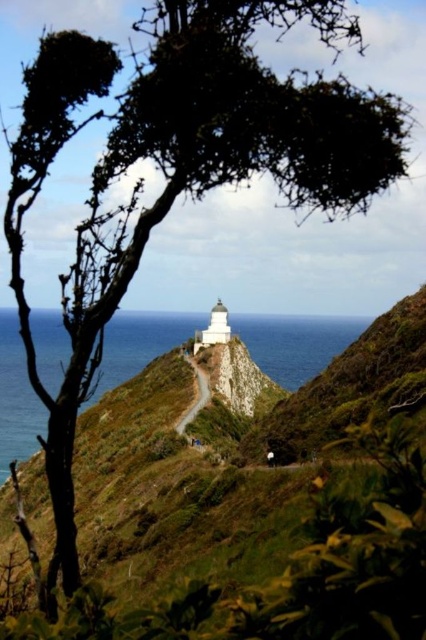
Question: Which object appears closest to the camera in this image?

Choices:
 (A) smooth concrete path at center
 (B) blue water at center

Answer: (A)

Question: Is blue water at center below smooth concrete path at center?

Choices:
 (A) yes
 (B) no

Answer: (B)

Question: Does blue water at center have a smaller size compared to smooth concrete path at center?

Choices:
 (A) no
 (B) yes

Answer: (A)

Question: Among these objects, which one is nearest to the camera?

Choices:
 (A) smooth concrete path at center
 (B) blue water at center

Answer: (A)

Question: Which of the following is the farthest from the observer?

Choices:
 (A) (138, 326)
 (B) (207, 396)

Answer: (A)

Question: Does blue water at center have a greater width compared to smooth concrete path at center?

Choices:
 (A) no
 (B) yes

Answer: (B)